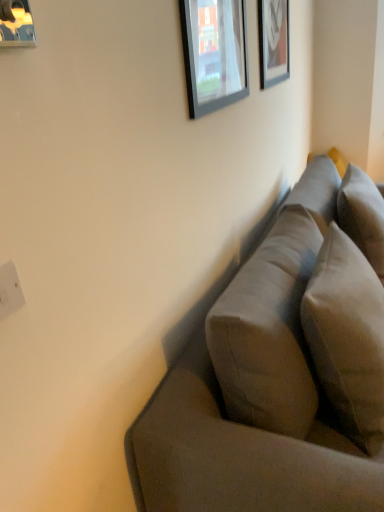
Question: In which direction should I rotate to look at matte glass picture frame at upper center, positioned as the 2th picture frame in right-to-left order?

Choices:
 (A) right
 (B) left

Answer: (A)

Question: Is white plastic electric outlet at lower left beside metallic silver picture frame at upper left, acting as the 1th picture frame starting from the left?

Choices:
 (A) no
 (B) yes

Answer: (A)

Question: Can we say white plastic electric outlet at lower left lies outside metallic silver picture frame at upper left, the third picture frame viewed from the back?

Choices:
 (A) yes
 (B) no

Answer: (A)

Question: Is white plastic electric outlet at lower left not close to metallic silver picture frame at upper left, which is counted as the third picture frame, starting from the right?

Choices:
 (A) yes
 (B) no

Answer: (A)

Question: From a real-world perspective, is white plastic electric outlet at lower left physically above metallic silver picture frame at upper left, positioned as the first picture frame in front-to-back order?

Choices:
 (A) no
 (B) yes

Answer: (A)

Question: From the image's perspective, does white plastic electric outlet at lower left appear higher than metallic silver picture frame at upper left, acting as the 1th picture frame starting from the left?

Choices:
 (A) no
 (B) yes

Answer: (A)

Question: Is white plastic electric outlet at lower left turned away from metallic silver picture frame at upper left, positioned as the first picture frame in front-to-back order?

Choices:
 (A) no
 (B) yes

Answer: (A)

Question: Is suede-like gray couch at right closer to camera compared to wooden frame at upper right, acting as the first picture frame starting from the back?

Choices:
 (A) yes
 (B) no

Answer: (A)

Question: Is suede-like gray couch at right further to camera compared to wooden frame at upper right, marked as the 3th picture frame in a left-to-right arrangement?

Choices:
 (A) no
 (B) yes

Answer: (A)

Question: Is suede-like gray couch at right outside wooden frame at upper right, positioned as the third picture frame in front-to-back order?

Choices:
 (A) yes
 (B) no

Answer: (A)

Question: From the image's perspective, is suede-like gray couch at right under wooden frame at upper right, acting as the first picture frame starting from the back?

Choices:
 (A) yes
 (B) no

Answer: (A)

Question: From a real-world perspective, is suede-like gray couch at right beneath wooden frame at upper right, positioned as the third picture frame in front-to-back order?

Choices:
 (A) no
 (B) yes

Answer: (B)

Question: Considering the relative sizes of suede-like gray couch at right and wooden frame at upper right, acting as the first picture frame starting from the back, in the image provided, is suede-like gray couch at right smaller than wooden frame at upper right, acting as the first picture frame starting from the back,?

Choices:
 (A) yes
 (B) no

Answer: (B)

Question: Is white plastic electric outlet at lower left further to camera compared to matte glass picture frame at upper center, which is the 2th picture frame from back to front?

Choices:
 (A) yes
 (B) no

Answer: (B)